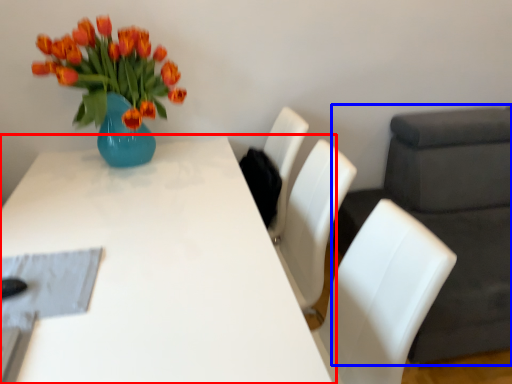
Question: Which of the following is the closest to the observer, table (highlighted by a red box) or swivel chair (highlighted by a blue box)?

Choices:
 (A) table
 (B) swivel chair

Answer: (A)